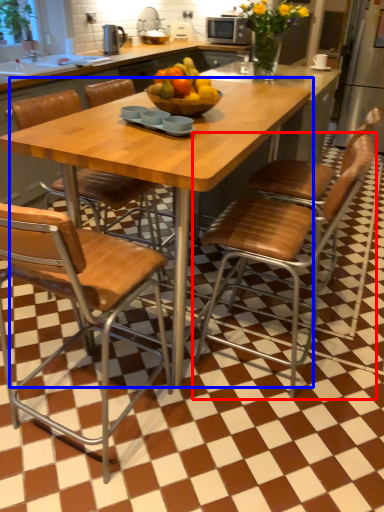
Question: Among these objects, which one is nearest to the camera, chair (highlighted by a red box) or kitchen & dining room table (highlighted by a blue box)?

Choices:
 (A) chair
 (B) kitchen & dining room table

Answer: (B)